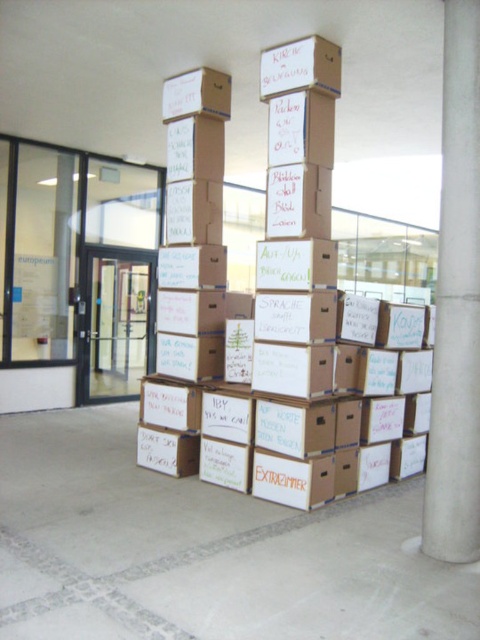
Based on the photo, can you confirm if white concrete pillar at center is positioned to the left of matte cardboard box at upper center?

No, white concrete pillar at center is not to the left of matte cardboard box at upper center.

Who is more forward, (444, 244) or (216, 76)?

Point (444, 244)

The height and width of the screenshot is (640, 480). Find the location of `white concrete pillar at center`. white concrete pillar at center is located at coordinates (456, 305).

The image size is (480, 640). Describe the element at coordinates (456, 305) in the screenshot. I see `white concrete pillar at center` at that location.

Can you confirm if white concrete pillar at center is shorter than white cardboard box at center?

No, white concrete pillar at center is not shorter than white cardboard box at center.

The height and width of the screenshot is (640, 480). Describe the element at coordinates (456, 305) in the screenshot. I see `white concrete pillar at center` at that location.

The image size is (480, 640). What are the coordinates of `white concrete pillar at center` in the screenshot? It's located at point(456,305).

Does point (195, 132) lie behind point (225, 72)?

No, (195, 132) is in front of (225, 72).

Which is below, brown cardboard box at center or matte cardboard box at upper center?

brown cardboard box at center

Is point (180, 342) closer to viewer compared to point (192, 100)?

That is False.

Locate an element on the screen. brown cardboard box at center is located at coordinates (277, 332).